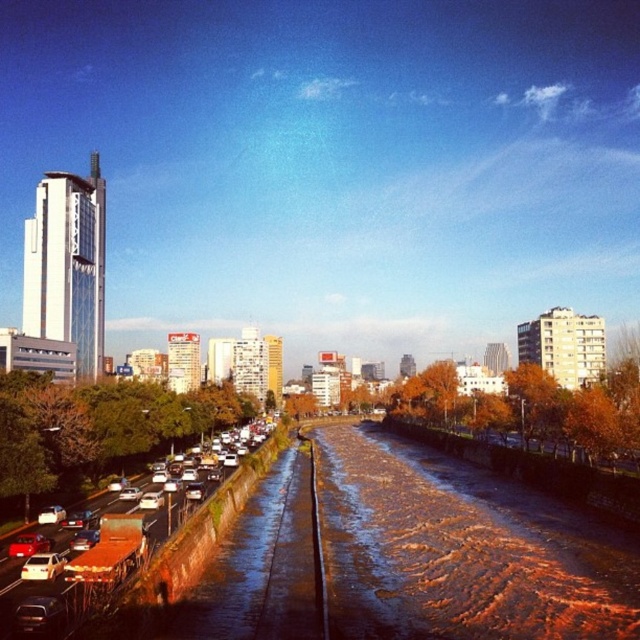
You are standing at the center of the image and want to locate the metallic silver sedan at lower left. According to the coordinates, where is it positioned relative to your current location?

The metallic silver sedan at lower left is positioned at coordinates point (42,566), which is to the lower left of your current location at the center.

You are standing at the point closest to the viewer in the image. Which of the two points, point [26,570] or point [40,541], are you standing at?

You are standing at point [26,570] because it is in front of point [40,541].

You are standing at the edge of the canal and want to walk towards the point labeled point (168, 534). However, there is an obstacle at point labeled point (58, 568). Which point is closer to you, the obstacle or your destination?

Point (168, 534) is further to the viewer than point (58, 568). Therefore, the obstacle at point (58, 568) is closer to you, so you need to navigate around it to reach your destination.